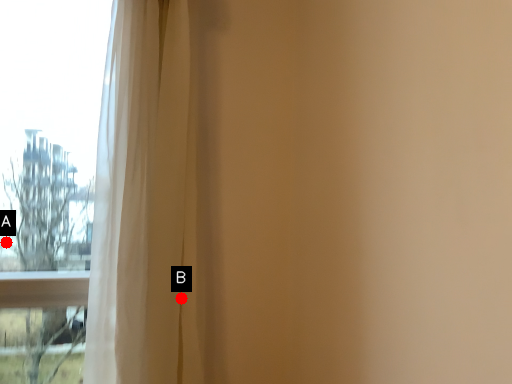
Question: Two points are circled on the image, labeled by A and B beside each circle. Which point is closer to the camera?

Choices:
 (A) A is closer
 (B) B is closer

Answer: (B)